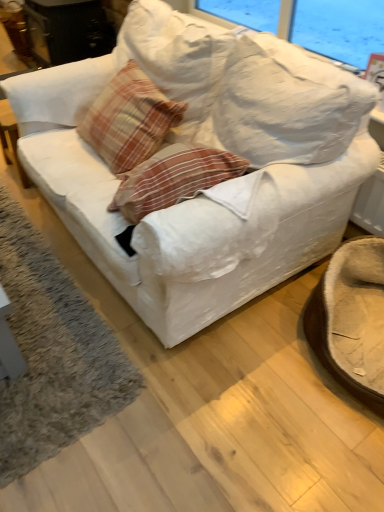
Question: From a real-world perspective, is soft gray carpet at lower left physically located above or below plaid fabric pillow at center?

Choices:
 (A) above
 (B) below

Answer: (B)

Question: Is soft gray carpet at lower left wider or thinner than plaid fabric pillow at center?

Choices:
 (A) wide
 (B) thin

Answer: (A)

Question: Which of these objects is positioned farthest from the soft gray carpet at lower left?

Choices:
 (A) white fabric couch at center
 (B) brown fuzzy swivel chair at lower right
 (C) plaid fabric pillow at center

Answer: (B)

Question: Considering the real-world distances, which object is closest to the soft gray carpet at lower left?

Choices:
 (A) plaid fabric pillow at center
 (B) white fabric couch at center
 (C) brown fuzzy swivel chair at lower right

Answer: (B)